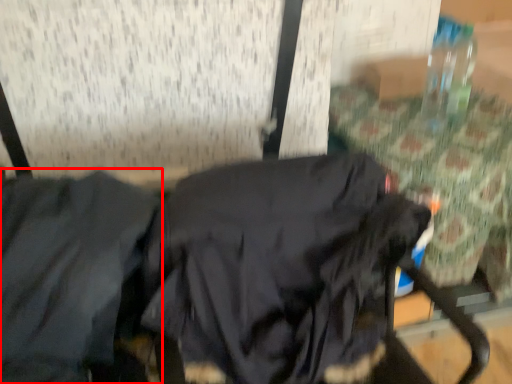
Question: From the image's perspective, what is the correct spatial relationship of jacket (annotated by the red box) in relation to sweatshirt?

Choices:
 (A) below
 (B) above

Answer: (B)